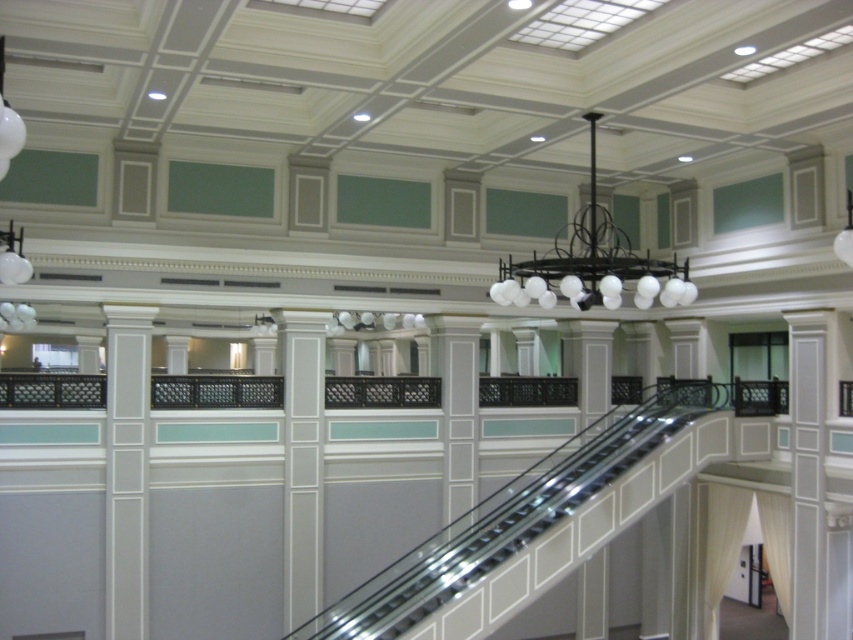
Consider the image. You are standing at the entrance of the grand building and want to reach the upper floor. The metallic escalator at center is your only option. Based on its position, can you estimate how far you need to walk from your current position to reach the escalator?

The metallic escalator at center is located at point 0.806 on the x and 0.601 on the y coordinate. Since you are at the entrance, you would need to walk approximately 0.806 meters horizontally and 0.601 meters vertically to reach it.

You are an interior designer assessing the space for safety. The metallic escalator at center and the black matte chandelier at upper center are both present. Given their sizes, which object might pose a higher risk of obstructing emergency exits?

The black matte chandelier at upper center is larger than the metallic escalator at center, so it might pose a higher risk of obstructing emergency exits.